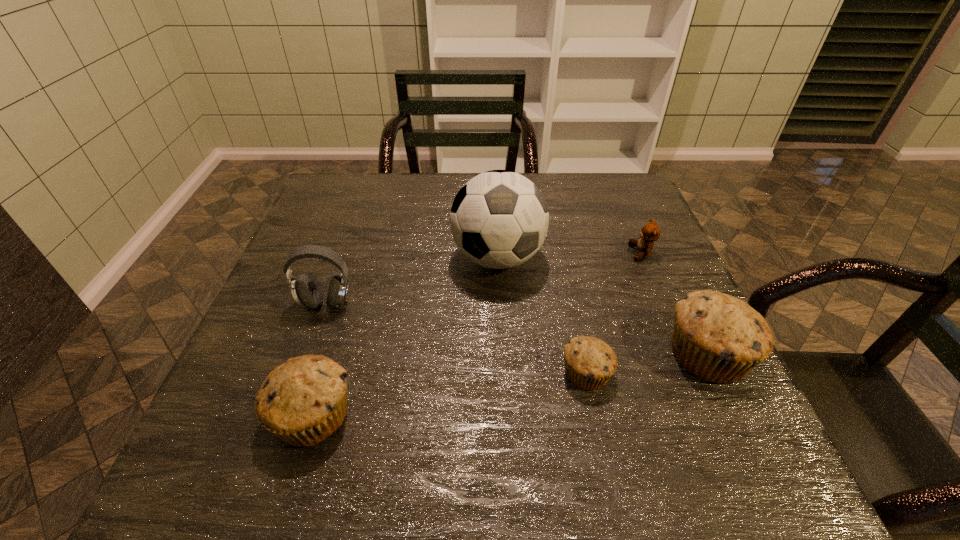
Identify the location of object situated at the near right corner. The height and width of the screenshot is (540, 960). (719, 338).

Identify the location of vacant space at the far edge of the desktop. tap(557, 194).

Where is `free space at the near edge`? free space at the near edge is located at coordinates (450, 413).

In order to click on free space at the left edge in this screenshot , I will do `click(321, 284)`.

The image size is (960, 540). What are the coordinates of `free location at the right edge of the desktop` in the screenshot? It's located at (661, 247).

Locate an element on the screen. This screenshot has width=960, height=540. blank space at the far left corner of the desktop is located at coordinates (328, 185).

You are a GUI agent. You are given a task and a screenshot of the screen. Output one action in this format:
    pyautogui.click(x=<x>, y=<y>)
    Task: Click on the vacant space at the near right corner of the desktop
    This screenshot has height=540, width=960.
    Given the screenshot: What is the action you would take?
    pyautogui.click(x=702, y=423)

Find the location of a particular element. vacant area that lies between the headset and the teddy bear is located at coordinates (484, 278).

The image size is (960, 540). I want to click on free space that is in between the tallest object and the headset, so click(x=412, y=280).

What are the coordinates of `vacant area between the shortest muffin and the teddy bear` in the screenshot? It's located at (613, 313).